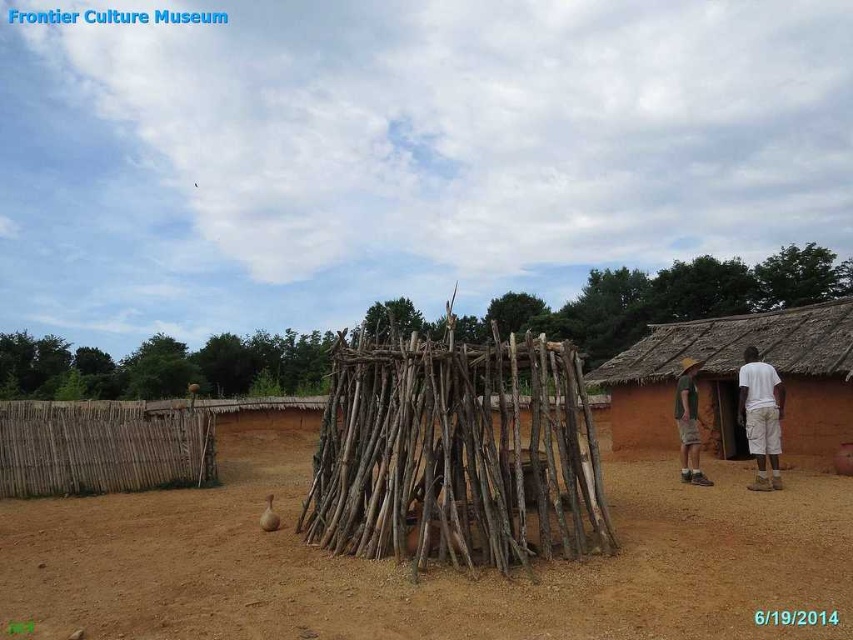
You are visiting the Frontier Culture Museum and notice a brown mud hut at right and a white cotton shirt at right. Which object is located higher in the scene?

The brown mud hut at right is positioned over the white cotton shirt at right, so the brown mud hut at right is higher.

You are a visitor at the Frontier Culture Museum and notice a brown dirt field at center and a white cotton shirt at right. Which object is located below the other?

The brown dirt field at center is positioned under the white cotton shirt at right, meaning the dirt field is below the shirt.